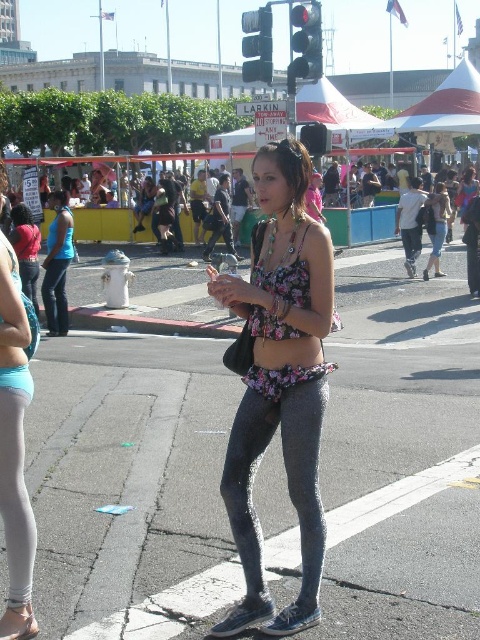
In order to click on matte blue leggings at center in this screenshot , I will do `click(14, 451)`.

Can you confirm if gray textured leggings at center is taller than metallic traffic light at upper center?

No, gray textured leggings at center is not taller than metallic traffic light at upper center.

Find the location of a particular element. gray textured leggings at center is located at coordinates (287, 477).

Based on the photo, does black plastic traffic light at upper center have a lesser width compared to metallic traffic light at upper center?

No.

Between point (308, 8) and point (267, 35), which one is positioned in front?

Point (308, 8) is more forward.

The image size is (480, 640). Find the location of `black plastic traffic light at upper center`. black plastic traffic light at upper center is located at coordinates (305, 42).